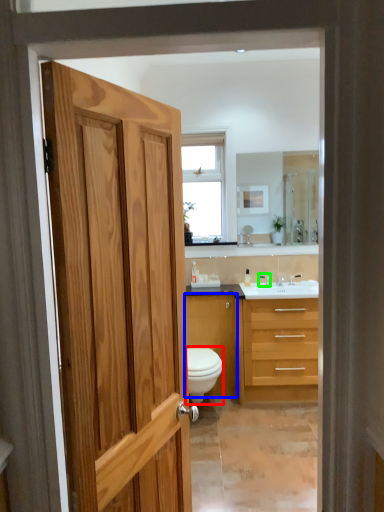
Question: Estimate the real-world distances between objects in this image. Which object is closer to toilet (highlighted by a red box), cabinetry (highlighted by a blue box) or faucet (highlighted by a green box)?

Choices:
 (A) cabinetry
 (B) faucet

Answer: (A)